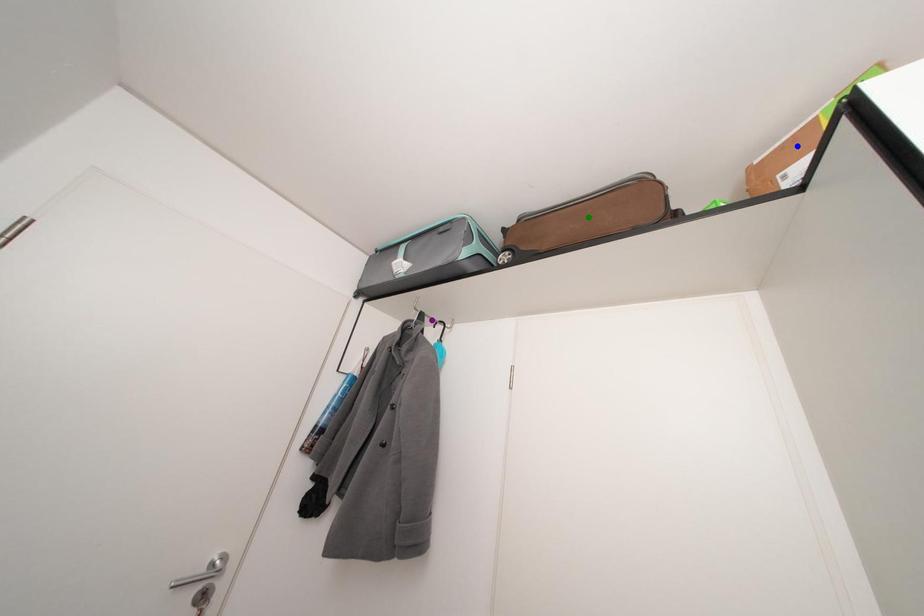
Order these from nearest to farthest:
- green point
- blue point
- purple point

blue point → green point → purple point